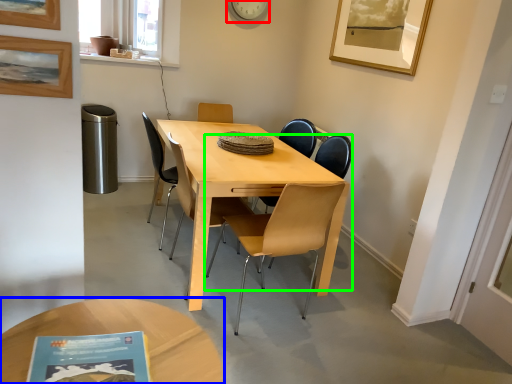
Question: Which object is the closest to the clock (highlighted by a red box)? Choose among these: coffee table (highlighted by a blue box) or chair (highlighted by a green box).

Choices:
 (A) coffee table
 (B) chair

Answer: (B)